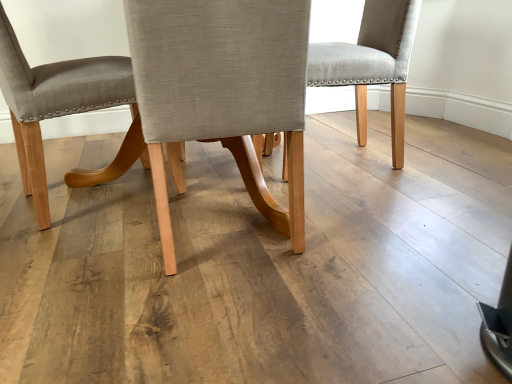
At what (x,y) coordinates should I click in order to perform the action: click on vacant space that is to the left of light gray fabric chair at center, which is counted as the second chair, starting from the left. Please return your answer as a coordinate pair (x, y). Looking at the image, I should click on (84, 256).